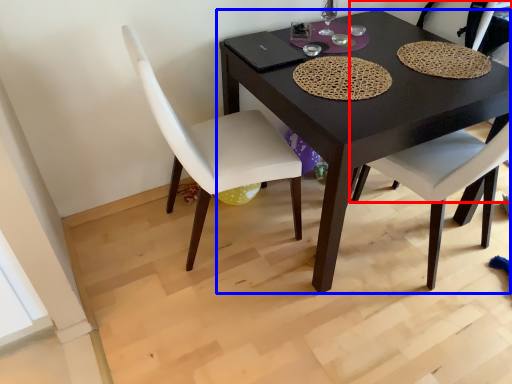
Question: Which object appears farthest to the camera in this image, chair (highlighted by a red box) or table (highlighted by a blue box)?

Choices:
 (A) chair
 (B) table

Answer: (A)